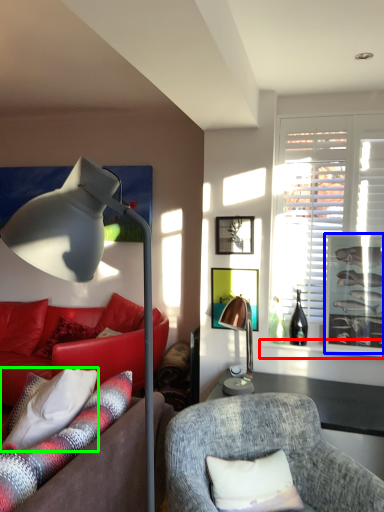
Question: Considering the real-world distances, which object is closest to window sill (highlighted by a red box)? picture frame (highlighted by a blue box) or pillow (highlighted by a green box).

Choices:
 (A) picture frame
 (B) pillow

Answer: (A)